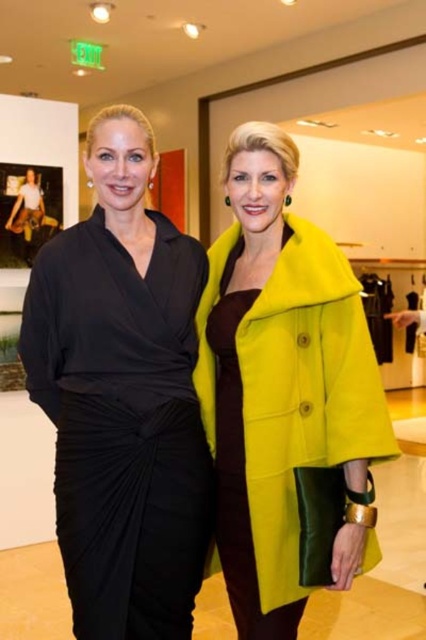
Based on the photo, you are a photographer setting up for a group photo. You need to ensure that the matte black dress at left and the matte green coat at center are both visible in the frame. Given their heights, which one might you need to adjust the camera angle for to ensure proper framing?

The matte black dress at left is taller than the matte green coat at center, so you may need to lower the camera angle slightly to ensure the taller matte black dress at left is fully visible while still capturing the shorter matte green coat at center in the frame.

Based on the photo, you are a photographer setting up a shoot for a fashion magazine. You need to arrange the two models wearing the matte black dress at left and the matte green coat at center so that their outfits are clearly visible. Given the width difference between the two outfits, which model should stand closer to the camera to ensure both outfits are fully visible in the photo?

The matte black dress at left is wider than the matte green coat at center. To ensure both outfits are fully visible, the model in the matte black dress at left should stand closer to the camera since wider garments require more space and being closer helps capture the entire width without cropping.